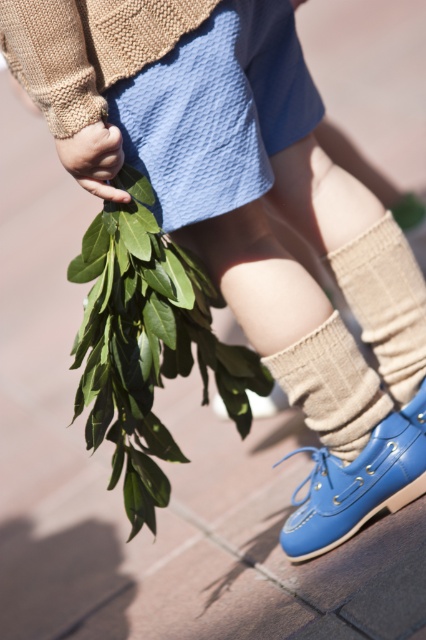
How far apart are blue leather shoe at lower right and beige knitted sock at lower center?

blue leather shoe at lower right is 5.69 inches from beige knitted sock at lower center.

Where is `blue leather shoe at lower right`? This screenshot has height=640, width=426. blue leather shoe at lower right is located at coordinates (359, 483).

Where is `blue leather shoe at lower right`? blue leather shoe at lower right is located at coordinates (359, 483).

Where is `blue leather shoe at lower right`? blue leather shoe at lower right is located at coordinates (359, 483).

Who is more distant from viewer, (x=154, y=420) or (x=311, y=380)?

The point (x=154, y=420) is behind.

Locate an element on the screen. Image resolution: width=426 pixels, height=640 pixels. green leafy branch at lower left is located at coordinates (147, 342).

I want to click on green leafy branch at lower left, so click(147, 342).

Is green leafy branch at lower left smaller than knit beige sock at lower center?

No, green leafy branch at lower left is not smaller than knit beige sock at lower center.

Does green leafy branch at lower left have a greater height compared to knit beige sock at lower center?

Indeed, green leafy branch at lower left has a greater height compared to knit beige sock at lower center.

Find the location of `green leafy branch at lower left`. green leafy branch at lower left is located at coordinates (147, 342).